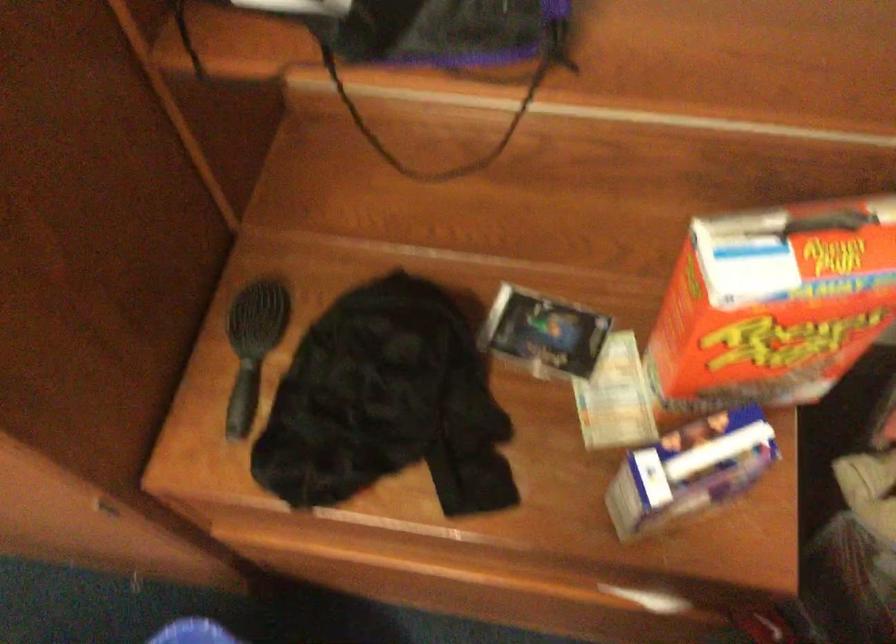
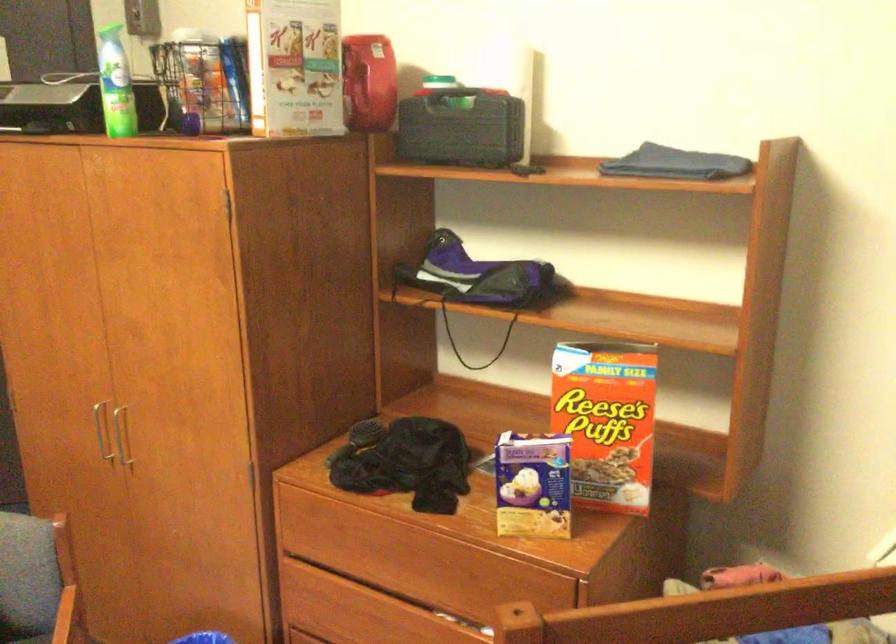
Where in the second image is the point corresponding to pixel 791 342 from the first image?

(606, 420)